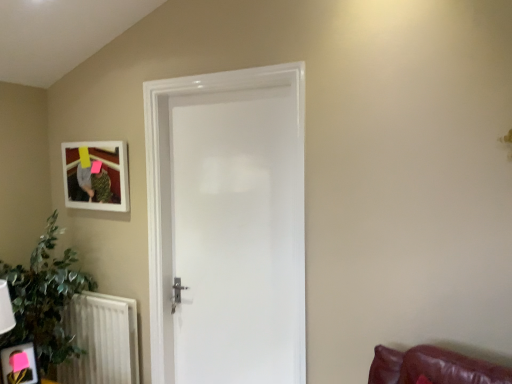
Measure the distance between white glossy door at center and camera.

The depth of white glossy door at center is 6.35 feet.

What is the approximate width of green leafy plant at lower left?

The width of green leafy plant at lower left is 21.75 inches.

This screenshot has width=512, height=384. Describe the element at coordinates (102, 340) in the screenshot. I see `white textured radiator at lower left` at that location.

The image size is (512, 384). In order to click on white matte picture frame at upper left, placed as the first picture frame when sorted from top to bottom in this screenshot , I will do `click(97, 176)`.

How much space does matte black picture frame at lower left, acting as the second picture frame starting from the back, occupy vertically?

10.22 inches.

Where is `matte black picture frame at lower left, acting as the second picture frame starting from the back`? matte black picture frame at lower left, acting as the second picture frame starting from the back is located at coordinates (19, 364).

You are a GUI agent. You are given a task and a screenshot of the screen. Output one action in this format:
    pyautogui.click(x=<x>, y=<y>)
    Task: Click on the white glossy door at center
    Image resolution: width=512 pixels, height=384 pixels.
    Given the screenshot: What is the action you would take?
    pyautogui.click(x=227, y=226)

Locate an element on the screen. The height and width of the screenshot is (384, 512). houseplant below the white matte picture frame at upper left, the first picture frame from the back (from a real-world perspective) is located at coordinates [x=44, y=300].

Would you say white matte picture frame at upper left, placed as the first picture frame when sorted from top to bottom, is part of green leafy plant at lower left's contents?

No.

Based on the photo, is green leafy plant at lower left at the right side of white matte picture frame at upper left, placed as the 2th picture frame when sorted from front to back?

No.

Is green leafy plant at lower left next to matte black picture frame at lower left, which is counted as the first picture frame, starting from the bottom, and touching it?

No, green leafy plant at lower left is not in contact with matte black picture frame at lower left, which is counted as the first picture frame, starting from the bottom.

Which is farther, [62,290] or [11,364]?

The point [62,290] is behind.

Is green leafy plant at lower left turned away from matte black picture frame at lower left, which is the 2th picture frame in top-to-bottom order?

That's not correct — green leafy plant at lower left is not looking away from matte black picture frame at lower left, which is the 2th picture frame in top-to-bottom order.

Can you tell me how much green leafy plant at lower left and matte black picture frame at lower left, which is the 2th picture frame in top-to-bottom order, differ in facing direction?

23.4 degrees.

Is white glossy door at center outside of white textured radiator at lower left?

white glossy door at center lies outside white textured radiator at lower left's area.

Is white glossy door at center to the left of white textured radiator at lower left from the viewer's perspective?

In fact, white glossy door at center is to the right of white textured radiator at lower left.

Considering the positions of points (283, 146) and (87, 369), is point (283, 146) closer to camera compared to point (87, 369)?

That is True.

What's the angular difference between white glossy door at center and white textured radiator at lower left's facing directions?

The facing directions of white glossy door at center and white textured radiator at lower left are 0.263 degrees apart.

From a real-world perspective, does white textured radiator at lower left stand above matte black picture frame at lower left, positioned as the first picture frame in front-to-back order?

No, from a real-world perspective, white textured radiator at lower left is not on top of matte black picture frame at lower left, positioned as the first picture frame in front-to-back order.

Is white textured radiator at lower left thinner than matte black picture frame at lower left, positioned as the first picture frame in front-to-back order?

Incorrect, the width of white textured radiator at lower left is not less than that of matte black picture frame at lower left, positioned as the first picture frame in front-to-back order.

Between white textured radiator at lower left and matte black picture frame at lower left, which is the 2th picture frame in top-to-bottom order, which one has larger size?

Bigger between the two is white textured radiator at lower left.

From the image's perspective, is white textured radiator at lower left on matte black picture frame at lower left, which is counted as the first picture frame, starting from the bottom?

No, from the image's perspective, white textured radiator at lower left is not over matte black picture frame at lower left, which is counted as the first picture frame, starting from the bottom.

Is white matte picture frame at upper left, which is counted as the second picture frame, starting from the bottom, not near green leafy plant at lower left?

No.

Considering their positions, is white matte picture frame at upper left, which is counted as the second picture frame, starting from the bottom, located in front of or behind green leafy plant at lower left?

white matte picture frame at upper left, which is counted as the second picture frame, starting from the bottom, is behind green leafy plant at lower left.

From a real-world perspective, is white matte picture frame at upper left, which is counted as the second picture frame, starting from the bottom, below green leafy plant at lower left?

No, from a real-world perspective, white matte picture frame at upper left, which is counted as the second picture frame, starting from the bottom, is not beneath green leafy plant at lower left.

Does white matte picture frame at upper left, placed as the 2th picture frame when sorted from front to back, have a lesser height compared to green leafy plant at lower left?

Indeed, white matte picture frame at upper left, placed as the 2th picture frame when sorted from front to back, has a lesser height compared to green leafy plant at lower left.

Is white textured radiator at lower left aimed at white matte picture frame at upper left, placed as the first picture frame when sorted from top to bottom?

No, white textured radiator at lower left is not turned towards white matte picture frame at upper left, placed as the first picture frame when sorted from top to bottom.

From the image's perspective, between white textured radiator at lower left and white matte picture frame at upper left, which is counted as the second picture frame, starting from the bottom, who is located below?

From the image's view, white textured radiator at lower left is below.

Is the position of white textured radiator at lower left more distant than that of white matte picture frame at upper left, placed as the 2th picture frame when sorted from front to back?

That is False.

Does white matte picture frame at upper left, which is counted as the second picture frame, starting from the bottom, turn towards matte black picture frame at lower left, which is counted as the first picture frame, starting from the bottom?

No.

Can you tell me how much white matte picture frame at upper left, the first picture frame from the back, and matte black picture frame at lower left, which is the 2th picture frame in top-to-bottom order, differ in facing direction?

The angular difference between white matte picture frame at upper left, the first picture frame from the back, and matte black picture frame at lower left, which is the 2th picture frame in top-to-bottom order, is 66.3 degrees.

Who is taller, white matte picture frame at upper left, placed as the first picture frame when sorted from top to bottom, or matte black picture frame at lower left, which is the 2th picture frame in top-to-bottom order?

white matte picture frame at upper left, placed as the first picture frame when sorted from top to bottom, is taller.

Locate an element on the screen. Image resolution: width=512 pixels, height=384 pixels. picture frame located above the green leafy plant at lower left (from the image's perspective) is located at coordinates (97, 176).

Starting from the green leafy plant at lower left, which picture frame is the 1st one to the right? Please provide its 2D coordinates.

[(19, 364)]

Which object lies nearer to the anchor point white glossy door at center, green leafy plant at lower left or white textured radiator at lower left?

The object closer to white glossy door at center is white textured radiator at lower left.

Considering their positions, is white matte picture frame at upper left, which is counted as the second picture frame, starting from the bottom, positioned further to green leafy plant at lower left than matte black picture frame at lower left, positioned as the first picture frame in front-to-back order?

The object further to green leafy plant at lower left is white matte picture frame at upper left, which is counted as the second picture frame, starting from the bottom.

Considering their positions, is white textured radiator at lower left positioned further to matte black picture frame at lower left, positioned as the first picture frame in front-to-back order, than green leafy plant at lower left?

Based on the image, white textured radiator at lower left appears to be further to matte black picture frame at lower left, positioned as the first picture frame in front-to-back order.

Estimate the real-world distances between objects in this image. Which object is further from white matte picture frame at upper left, which is counted as the second picture frame, starting from the bottom, matte black picture frame at lower left, which is the 2th picture frame in top-to-bottom order, or white textured radiator at lower left?

The object further to white matte picture frame at upper left, which is counted as the second picture frame, starting from the bottom, is matte black picture frame at lower left, which is the 2th picture frame in top-to-bottom order.

Which object lies further to the anchor point white matte picture frame at upper left, the first picture frame from the back, white glossy door at center or white textured radiator at lower left?

white textured radiator at lower left is further to white matte picture frame at upper left, the first picture frame from the back.

Estimate the real-world distances between objects in this image. Which object is closer to white textured radiator at lower left, matte black picture frame at lower left, which is the 2th picture frame in top-to-bottom order, or white glossy door at center?

matte black picture frame at lower left, which is the 2th picture frame in top-to-bottom order.

Based on their spatial positions, is white glossy door at center or matte black picture frame at lower left, which is counted as the first picture frame, starting from the bottom, closer to green leafy plant at lower left?

matte black picture frame at lower left, which is counted as the first picture frame, starting from the bottom.

Considering their positions, is white glossy door at center positioned closer to white textured radiator at lower left than green leafy plant at lower left?

green leafy plant at lower left is positioned closer to the anchor white textured radiator at lower left.

At what (x,y) coordinates should I click in order to perform the action: click on radiator between matte black picture frame at lower left, which is counted as the first picture frame, starting from the bottom, and white glossy door at center. Please return your answer as a coordinate pair (x, y). The width and height of the screenshot is (512, 384). Looking at the image, I should click on (102, 340).

Locate an element on the screen. The width and height of the screenshot is (512, 384). houseplant between white matte picture frame at upper left, which is counted as the second picture frame, starting from the bottom, and matte black picture frame at lower left, which is counted as the first picture frame, starting from the bottom, vertically is located at coordinates (44, 300).

Locate an element on the screen. The width and height of the screenshot is (512, 384). door that lies between white matte picture frame at upper left, the first picture frame from the back, and white textured radiator at lower left from top to bottom is located at coordinates (227, 226).

What are the coordinates of `picture frame between white matte picture frame at upper left, which is counted as the second picture frame, starting from the bottom, and white textured radiator at lower left from top to bottom` in the screenshot? It's located at (19, 364).